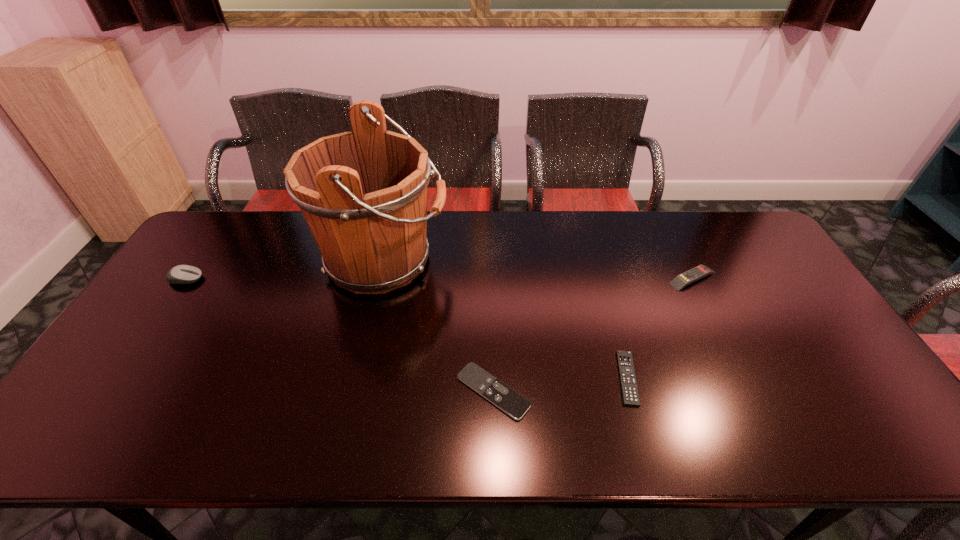
Find the location of `free space that satisfies the following two spatial constraints: 1. with the handle on the side of the second object from right to left; 2. on the left side of the bucket`. free space that satisfies the following two spatial constraints: 1. with the handle on the side of the second object from right to left; 2. on the left side of the bucket is located at coordinates (356, 378).

The height and width of the screenshot is (540, 960). I want to click on blank area in the image that satisfies the following two spatial constraints: 1. with the handle on the side of the leftmost remote control; 2. on the left side of the bucket, so click(x=353, y=391).

The height and width of the screenshot is (540, 960). I want to click on vacant position in the image that satisfies the following two spatial constraints: 1. on the wheel side of the third object from right to left; 2. on the right side of the computer equipment, so click(108, 391).